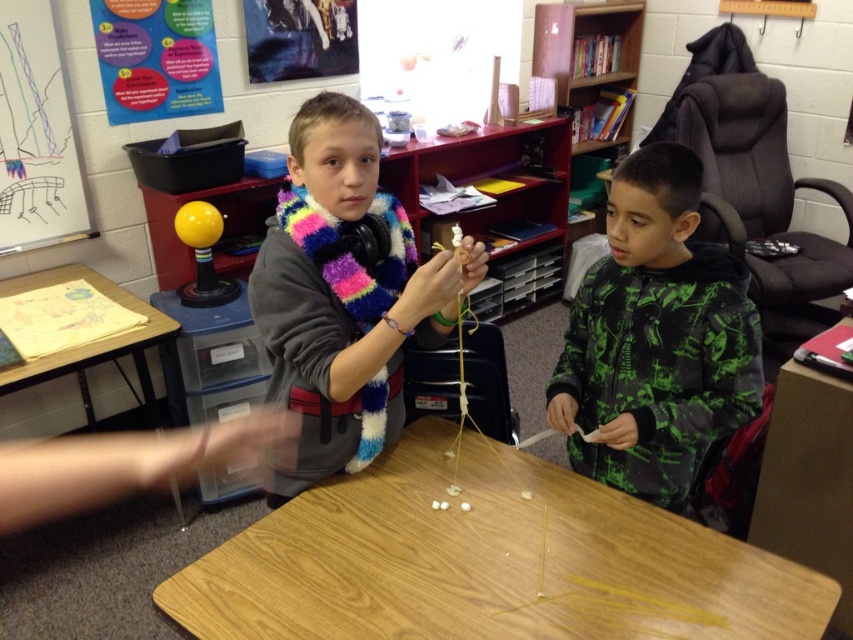
In the scene shown: Can you confirm if multicolored fuzzy scarf at center is taller than whiteboard at upper left?

Correct, multicolored fuzzy scarf at center is much taller as whiteboard at upper left.

Between multicolored fuzzy scarf at center and whiteboard at upper left, which one is positioned lower?

Positioned lower is multicolored fuzzy scarf at center.

Is point (308, 324) positioned after point (15, 246)?

No, it is in front of (15, 246).

At what (x,y) coordinates should I click in order to perform the action: click on multicolored fuzzy scarf at center. Please return your answer as a coordinate pair (x, y). Looking at the image, I should click on (344, 296).

Based on the photo, can you confirm if wooden table at center is positioned below wooden table at left?

Yes.

Does wooden table at center come in front of wooden table at left?

Yes, it is.

I want to click on wooden table at center, so click(x=486, y=561).

Which is more to the left, multicolored fuzzy scarf at center or wooden table at left?

wooden table at left

You are a GUI agent. You are given a task and a screenshot of the screen. Output one action in this format:
    pyautogui.click(x=<x>, y=<y>)
    Task: Click on the multicolored fuzzy scarf at center
    This screenshot has width=853, height=640.
    Given the screenshot: What is the action you would take?
    pyautogui.click(x=344, y=296)